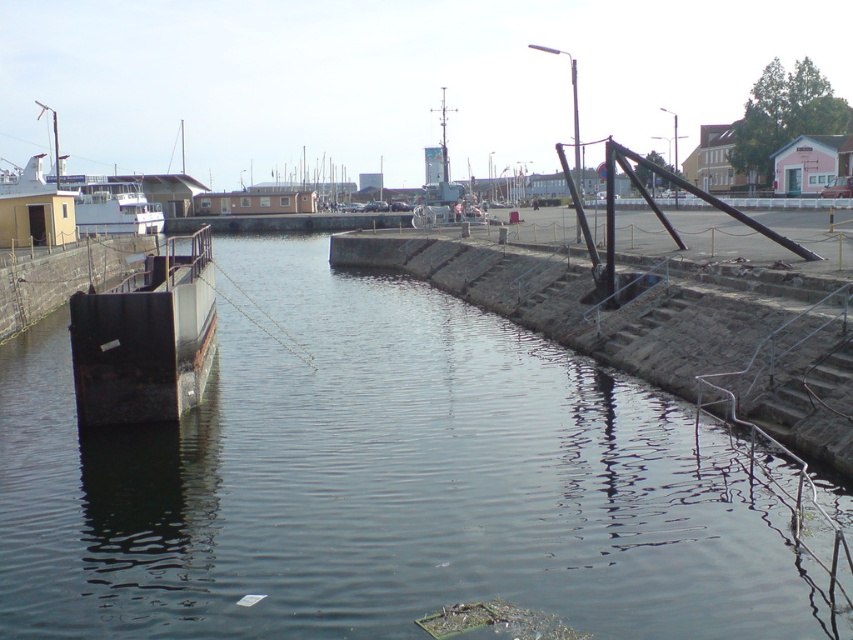
You are a dock worker who needs to move a container that is 160 feet long from the rusty metal barge at left to the white matte boat at left. Can you move the container between them without bending it?

The distance between the rusty metal barge at left and the white matte boat at left is 169.12 feet. Since the container is 160 feet long, it can be moved between them without bending as the distance is sufficient.

You are standing at the edge of the harbor and want to walk towards the two points labeled point (80, 332) and point (143, 216). Which point will you reach first?

You will reach point (80, 332) first because it is closer to you than point (143, 216).